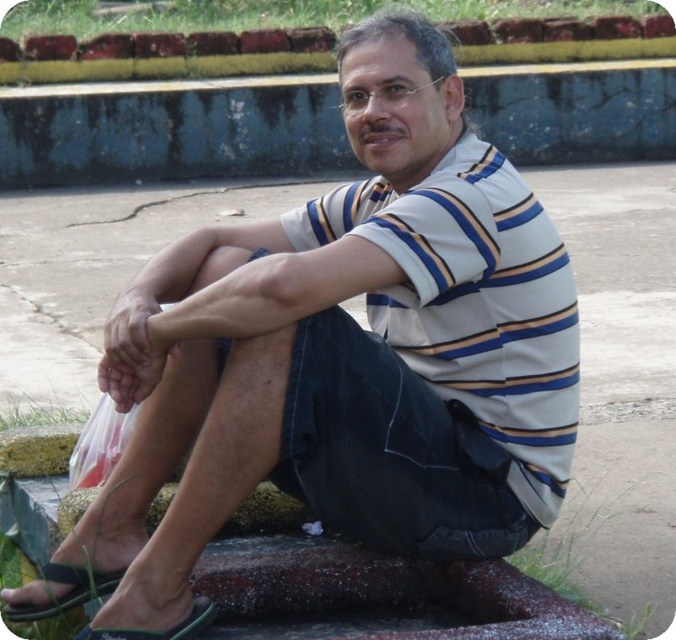
Between smooth concrete curb at upper center and green rubber sandal at lower left, which one is positioned lower?

green rubber sandal at lower left

Is point (548, 136) closer to viewer compared to point (68, 580)?

No, it is not.

I want to click on smooth concrete curb at upper center, so click(x=170, y=134).

Does green rubber sandal at lower left have a larger size compared to green fabric sandal at lower left?

Yes.

Between point (120, 577) and point (199, 602), which one is positioned in front?

Point (199, 602)

Does point (53, 577) come closer to viewer compared to point (197, 602)?

That is False.

I want to click on green rubber sandal at lower left, so click(66, 592).

Is point (464, 177) farther from camera compared to point (174, 630)?

Yes, point (464, 177) is farther from viewer.

Is point (464, 230) farther from camera compared to point (206, 605)?

No.

Locate an element on the screen. striped cotton polo shirt at center is located at coordinates (473, 301).